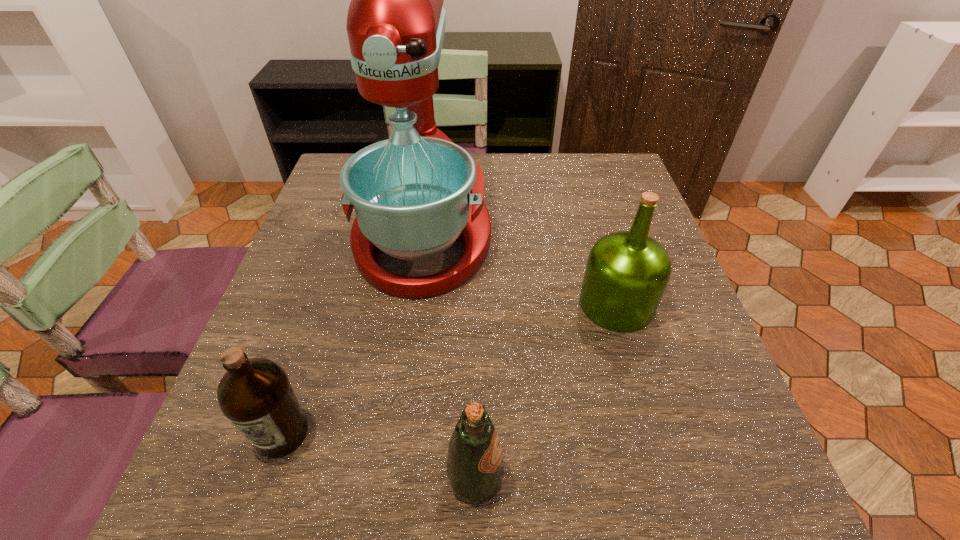
Locate an element on the screen. The image size is (960, 540). the tallest object is located at coordinates (414, 194).

The width and height of the screenshot is (960, 540). I want to click on the tallest olive oil, so pos(627,272).

Image resolution: width=960 pixels, height=540 pixels. In order to click on the rightmost olive oil in this screenshot , I will do `click(627, 272)`.

This screenshot has width=960, height=540. I want to click on the leftmost olive oil, so click(255, 394).

In order to click on the second olive oil from right to left in this screenshot , I will do `click(475, 469)`.

Locate an element on the screen. The height and width of the screenshot is (540, 960). vacant space situated 0.230m on the front-facing side of the mixer is located at coordinates (399, 406).

The height and width of the screenshot is (540, 960). What are the coordinates of `free space located 0.240m on the left of the rightmost object` in the screenshot? It's located at click(462, 304).

In order to click on vacant area located 0.170m on the front-facing side of the second olive oil from left to right in this screenshot , I will do `click(618, 478)`.

The image size is (960, 540). I want to click on object at the far edge, so click(x=414, y=194).

At what (x,y) coordinates should I click in order to perform the action: click on mixer situated at the left edge. Please return your answer as a coordinate pair (x, y). This screenshot has width=960, height=540. Looking at the image, I should click on (414, 194).